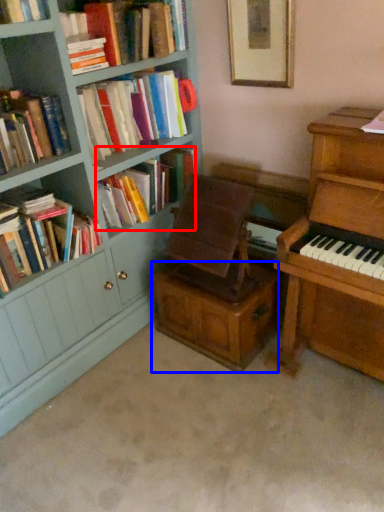
Question: Which point is further to the camera, book (highlighted by a red box) or drawer (highlighted by a blue box)?

Choices:
 (A) book
 (B) drawer

Answer: (A)